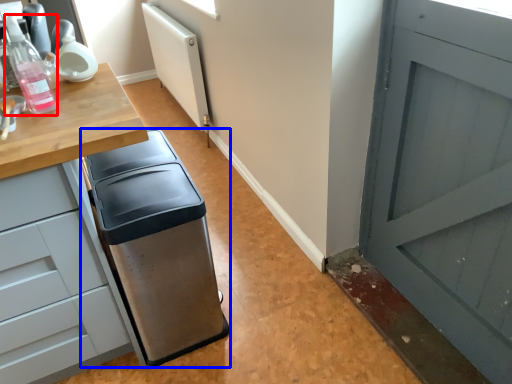
Question: Which of the following is the farthest to the observer, bottle (highlighted by a red box) or waste container (highlighted by a blue box)?

Choices:
 (A) bottle
 (B) waste container

Answer: (B)